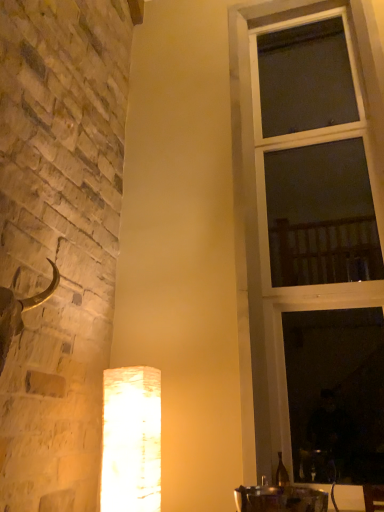
The width and height of the screenshot is (384, 512). What do you see at coordinates (131, 440) in the screenshot?
I see `white textured lamp at lower center` at bounding box center [131, 440].

Where is `white textured lamp at lower center`? This screenshot has width=384, height=512. white textured lamp at lower center is located at coordinates (131, 440).

The height and width of the screenshot is (512, 384). Describe the element at coordinates (266, 213) in the screenshot. I see `clear glass window at right` at that location.

Where is `clear glass window at right`? clear glass window at right is located at coordinates (266, 213).

This screenshot has height=512, width=384. I want to click on white textured lamp at lower center, so 131,440.

Is white textured lamp at lower center to the left or to the right of clear glass window at right in the image?

In the image, white textured lamp at lower center appears on the left side of clear glass window at right.

Is the depth of white textured lamp at lower center less than that of clear glass window at right?

Yes, it is in front of clear glass window at right.

Is point (117, 381) farther from viewer compared to point (279, 316)?

No, it is in front of (279, 316).

From the image's perspective, which object appears higher, white textured lamp at lower center or clear glass window at right?

clear glass window at right, from the image's perspective.

From a real-world perspective, who is located higher, white textured lamp at lower center or clear glass window at right?

From a 3D spatial view, clear glass window at right is above.

Which object is thinner, white textured lamp at lower center or clear glass window at right?

Thinner between the two is clear glass window at right.

Who is shorter, white textured lamp at lower center or clear glass window at right?

white textured lamp at lower center.

Considering the sizes of objects white textured lamp at lower center and clear glass window at right in the image provided, who is smaller, white textured lamp at lower center or clear glass window at right?

With smaller size is white textured lamp at lower center.

Would you say white textured lamp at lower center is inside or outside clear glass window at right?

white textured lamp at lower center is located beyond the bounds of clear glass window at right.

Are white textured lamp at lower center and clear glass window at right beside each other?

white textured lamp at lower center is not next to clear glass window at right, and they're not touching.

Is white textured lamp at lower center facing away from clear glass window at right?

That's not correct — white textured lamp at lower center is not looking away from clear glass window at right.

What's the angular difference between white textured lamp at lower center and clear glass window at right's facing directions?

The angular difference between white textured lamp at lower center and clear glass window at right is 90.9 degrees.

I want to click on window behind the white textured lamp at lower center, so click(x=266, y=213).

Which is more to the right, clear glass window at right or white textured lamp at lower center?

clear glass window at right.

Is clear glass window at right positioned behind white textured lamp at lower center?

Yes, clear glass window at right is further from the viewer.

Considering the points (311, 5) and (133, 406), which point is in front, point (311, 5) or point (133, 406)?

The point (133, 406) is closer to the camera.

From the image's perspective, who appears lower, clear glass window at right or white textured lamp at lower center?

white textured lamp at lower center appears lower in the image.

Consider the image. From a real-world perspective, is clear glass window at right positioned above or below white textured lamp at lower center?

clear glass window at right is situated higher than white textured lamp at lower center in the real world.

Is clear glass window at right wider than white textured lamp at lower center?

No, clear glass window at right is not wider than white textured lamp at lower center.

Based on the photo, considering the sizes of clear glass window at right and white textured lamp at lower center in the image, is clear glass window at right taller or shorter than white textured lamp at lower center?

In the image, clear glass window at right appears to be taller than white textured lamp at lower center.

Looking at this image, can you confirm if clear glass window at right is smaller than white textured lamp at lower center?

Incorrect, clear glass window at right is not smaller in size than white textured lamp at lower center.

Is clear glass window at right inside the boundaries of white textured lamp at lower center, or outside?

The correct answer is: outside.

Are clear glass window at right and white textured lamp at lower center beside each other?

clear glass window at right and white textured lamp at lower center are clearly separated.

Is clear glass window at right looking in the opposite direction of white textured lamp at lower center?

clear glass window at right is not turned away from white textured lamp at lower center.

How different are the orientations of clear glass window at right and white textured lamp at lower center in degrees?

90.9 degrees.

Identify the location of lamp below the clear glass window at right (from the image's perspective). The image size is (384, 512). coord(131,440).

Find the location of a particular element. The width and height of the screenshot is (384, 512). window above the white textured lamp at lower center (from the image's perspective) is located at coordinates (266, 213).

Identify the location of lamp on the left of clear glass window at right. Image resolution: width=384 pixels, height=512 pixels. (131, 440).